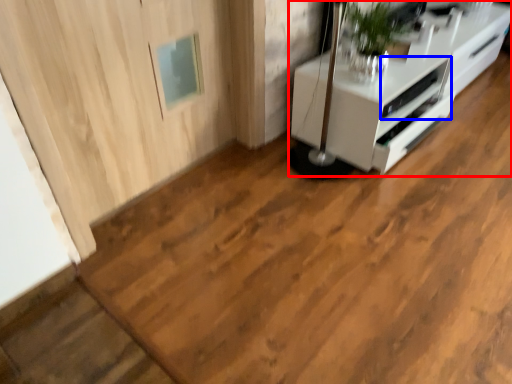
Question: Among these objects, which one is nearest to the camera, furniture (highlighted by a red box) or appliance (highlighted by a blue box)?

Choices:
 (A) furniture
 (B) appliance

Answer: (A)